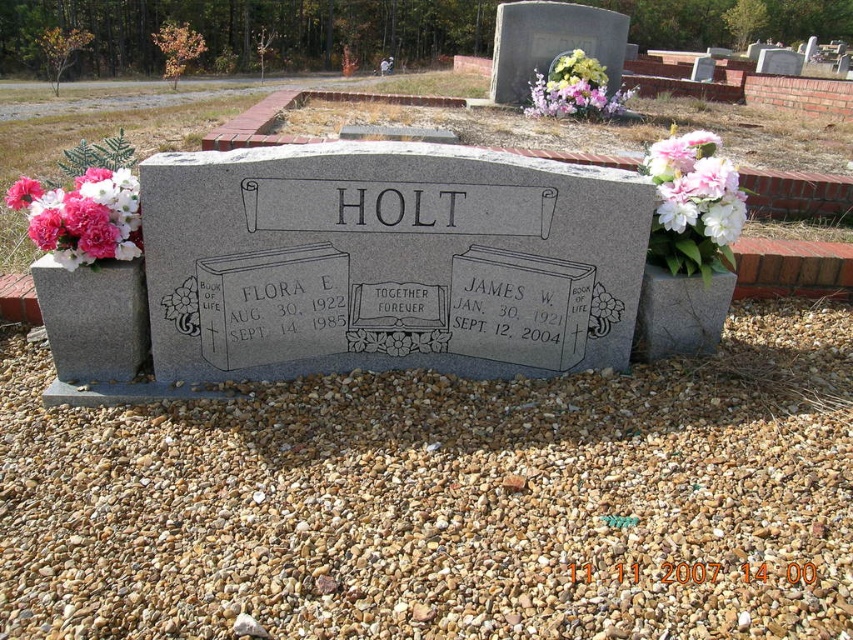
Is pink silk carnation at left below white matte flowers at upper right?

Yes.

Does pink silk carnation at left appear over white matte flowers at upper right?

No.

Locate an element on the screen. pink silk carnation at left is located at coordinates (82, 216).

Is white matte flowers at upper right positioned behind pink floral bouquet at upper center?

No, it is in front of pink floral bouquet at upper center.

Looking at this image, is white matte flowers at upper right thinner than pink floral bouquet at upper center?

Correct, white matte flowers at upper right's width is less than pink floral bouquet at upper center's.

Who is more distant from viewer, (x=728, y=243) or (x=552, y=67)?

Point (x=552, y=67)

Find the location of a particular element. The image size is (853, 640). white matte flowers at upper right is located at coordinates (695, 188).

Consider the image. Who is more distant from viewer, (76, 259) or (668, 564)?

The point (76, 259) is more distant.

You are a GUI agent. You are given a task and a screenshot of the screen. Output one action in this format:
    pyautogui.click(x=<x>, y=<y>)
    Task: Click on the pink silk carnation at left
    The image size is (853, 640).
    Given the screenshot: What is the action you would take?
    pyautogui.click(x=82, y=216)